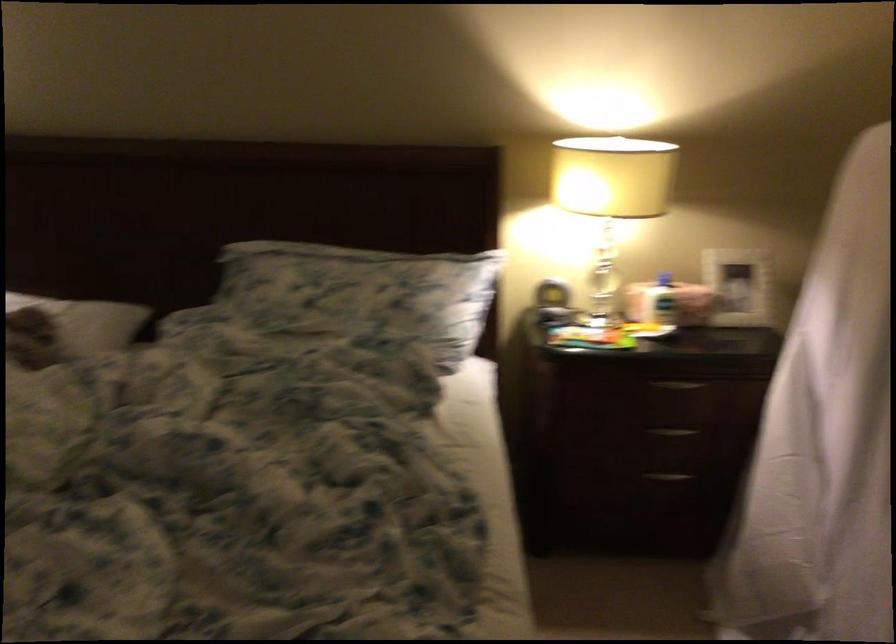
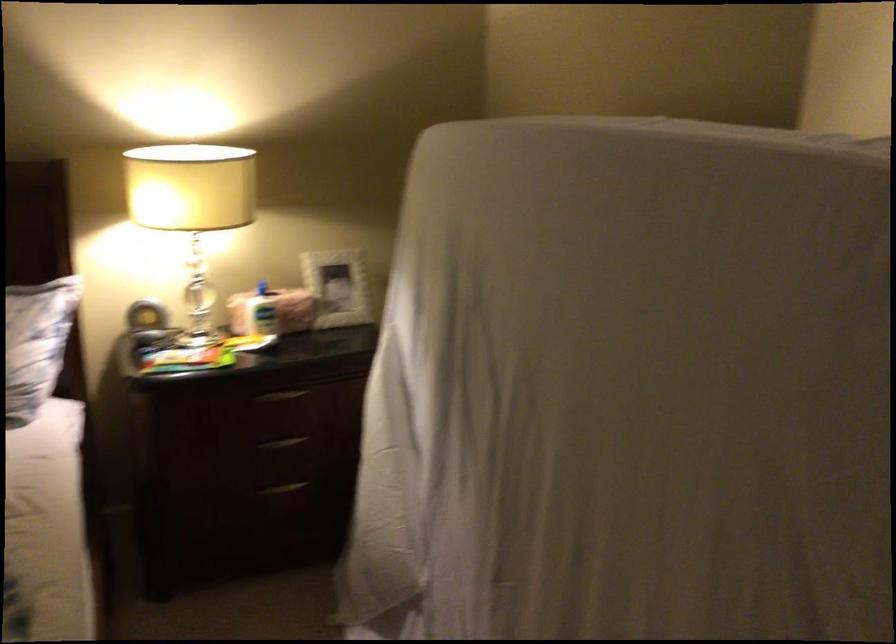
Where in the second image is the point corresponding to point 744,281 from the first image?

(337, 287)